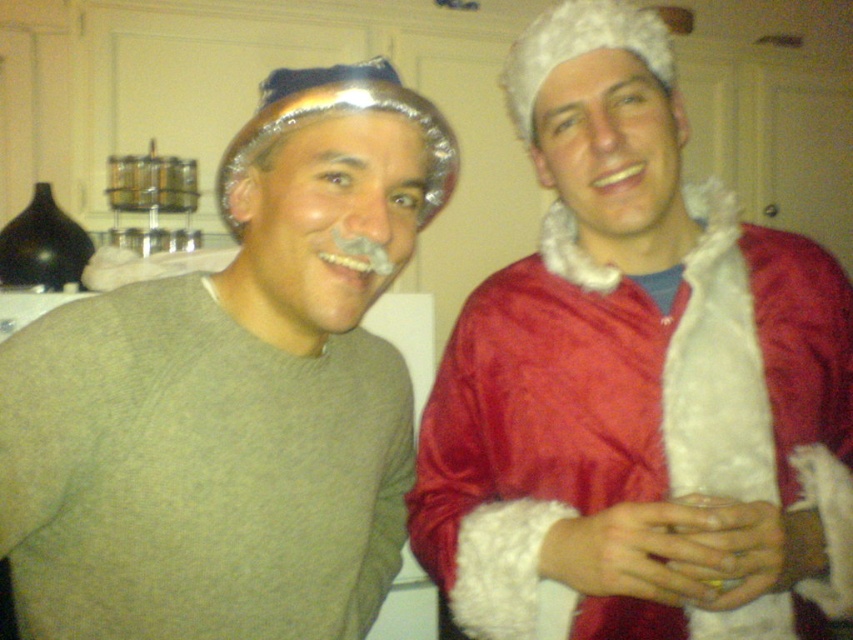
Who is more distant from viewer, (531, 353) or (287, 528)?

Point (531, 353)

Is point (753, 531) closer to viewer compared to point (216, 504)?

Yes.

Where is `red velvet santa coat at right`? The width and height of the screenshot is (853, 640). red velvet santa coat at right is located at coordinates (637, 381).

Locate an element on the screen. The width and height of the screenshot is (853, 640). red velvet santa coat at right is located at coordinates (637, 381).